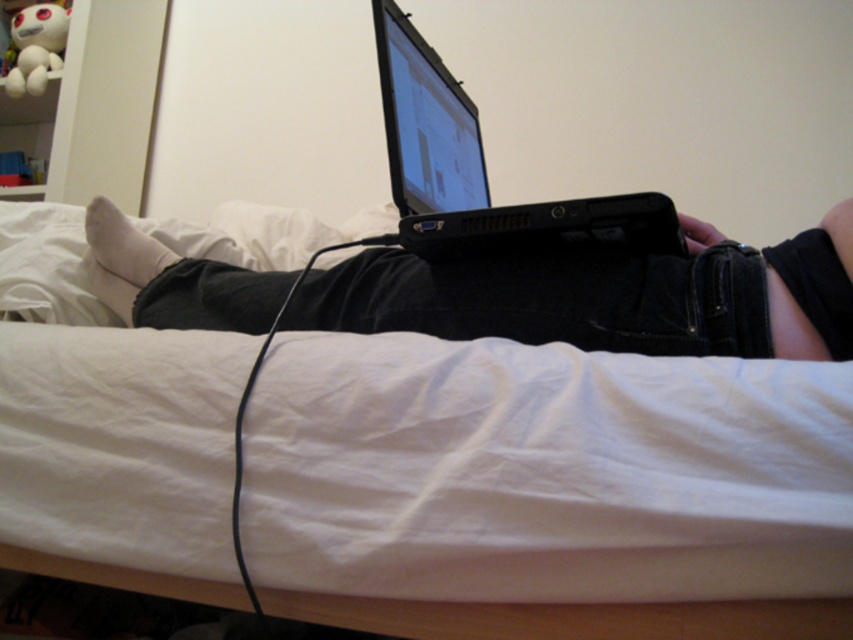
Between white fabric bed at center and black plastic laptop at center, which one is positioned higher?

black plastic laptop at center

Does white fabric bed at center lie in front of black plastic laptop at center?

Yes, it is.

Who is more forward, (236, 355) or (430, 76)?

Point (236, 355) is more forward.

The height and width of the screenshot is (640, 853). Find the location of `white fabric bed at center`. white fabric bed at center is located at coordinates (544, 486).

Is point (836, 424) positioned before point (849, 259)?

That is True.

Is point (80, 385) closer to camera compared to point (461, 285)?

Yes, point (80, 385) is closer to viewer.

You are a GUI agent. You are given a task and a screenshot of the screen. Output one action in this format:
    pyautogui.click(x=<x>, y=<y>)
    Task: Click on the white fabric bed at center
    The height and width of the screenshot is (640, 853).
    Given the screenshot: What is the action you would take?
    pyautogui.click(x=544, y=486)

Consider the image. Is black matte laptop at center taller than black plastic laptop at center?

Incorrect, black matte laptop at center's height is not larger of black plastic laptop at center's.

Is black matte laptop at center positioned before black plastic laptop at center?

No, black matte laptop at center is further to the viewer.

Find the location of a particular element. This screenshot has height=640, width=853. black matte laptop at center is located at coordinates (608, 298).